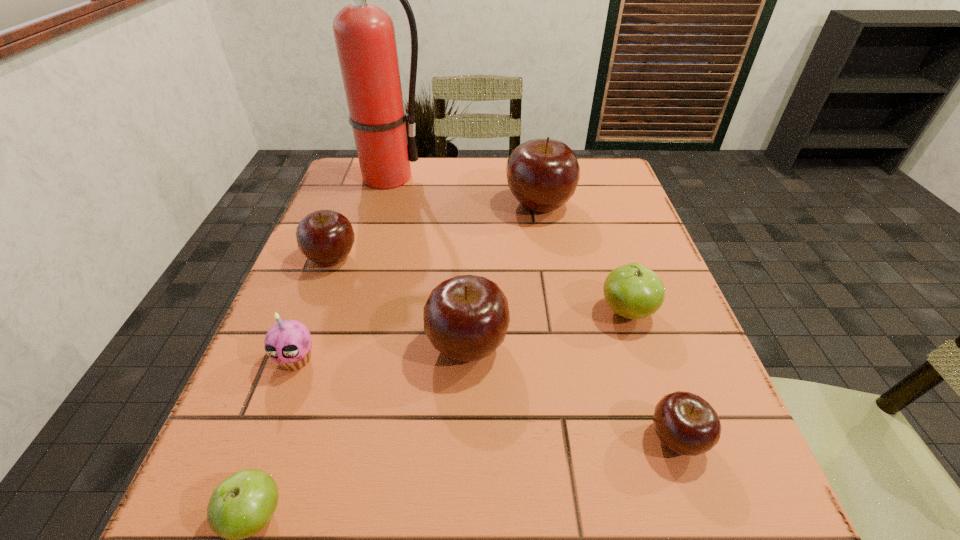
In the image, there is a desktop. What are the coordinates of `vacant space at the near left corner` in the screenshot? It's located at (194, 504).

At what (x,y) coordinates should I click in order to perform the action: click on free region at the far right corner. Please return your answer as a coordinate pair (x, y). The height and width of the screenshot is (540, 960). Looking at the image, I should click on (601, 158).

Find the location of a particular element. This screenshot has width=960, height=540. free space at the near right corner is located at coordinates (717, 512).

In order to click on vacant region between the tallest object and the fifth farthest apple in this screenshot , I will do `click(531, 308)`.

What are the coordinates of `empty space that is in between the tallest object and the third red apple from right to left` in the screenshot? It's located at (426, 261).

Locate an element on the screen. The image size is (960, 540). free space between the fire extinguisher and the farther green apple is located at coordinates (506, 244).

The height and width of the screenshot is (540, 960). In order to click on empty space between the biggest red apple and the tallest object in this screenshot , I will do `click(463, 191)`.

Where is `free spot between the sixth nearest object and the cupcake`? The image size is (960, 540). free spot between the sixth nearest object and the cupcake is located at coordinates (314, 308).

Find the location of a particular element. This screenshot has height=540, width=960. unoccupied area between the fourth object from right to left and the smallest red apple is located at coordinates (572, 392).

Locate an element on the screen. The width and height of the screenshot is (960, 540). vacant space in between the tallest apple and the fire extinguisher is located at coordinates (463, 191).